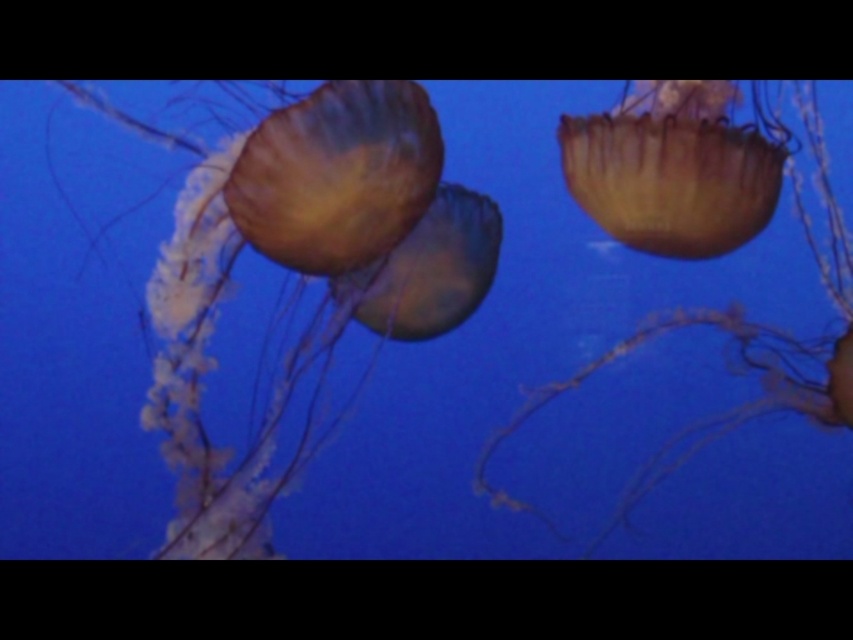
Question: Can you confirm if translucent yellowish jellyfish at center is positioned to the left of translucent yellow jellyfish at center?

Choices:
 (A) yes
 (B) no

Answer: (B)

Question: Does translucent gelatinous at left appear over translucent yellowish jellyfish at center?

Choices:
 (A) yes
 (B) no

Answer: (A)

Question: Which object is closer to the camera taking this photo?

Choices:
 (A) translucent yellowish jellyfish at center
 (B) translucent yellow jellyfish at center
 (C) translucent gelatinous at left

Answer: (C)

Question: Which object is farther from the camera taking this photo?

Choices:
 (A) translucent yellow jellyfish at center
 (B) translucent gelatinous at left

Answer: (A)

Question: Which object is closer to the camera taking this photo?

Choices:
 (A) translucent gelatinous at left
 (B) translucent yellow jellyfish at center

Answer: (A)

Question: Can you confirm if translucent gelatinous at left is wider than translucent yellowish jellyfish at center?

Choices:
 (A) yes
 (B) no

Answer: (B)